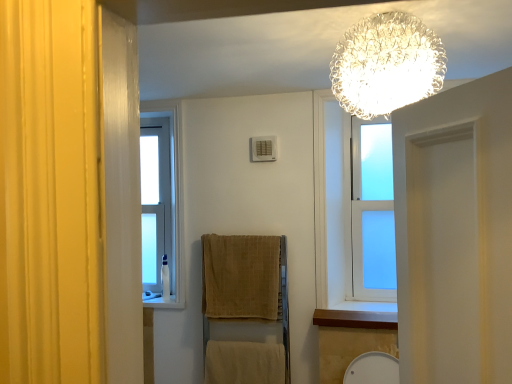
What do you see at coordinates (165, 278) in the screenshot?
I see `white plastic toiletry at left` at bounding box center [165, 278].

Image resolution: width=512 pixels, height=384 pixels. Describe the element at coordinates (241, 276) in the screenshot. I see `beige textured towel at center, which is counted as the 1th bath towel, starting from the top` at that location.

What are the coordinates of `beige cotton towel at lower center, placed as the second bath towel when sorted from top to bottom` in the screenshot? It's located at (244, 363).

This screenshot has width=512, height=384. I want to click on clear glass window at left, so [x=164, y=200].

Describe the element at coordinates (355, 319) in the screenshot. I see `wooden at lower right` at that location.

What is the approximate height of wooden at lower right?

2.29 inches.

Locate an element on the screen. The image size is (512, 384). white plastic toiletry at left is located at coordinates click(165, 278).

Is white plastic toiletry at left thinner than beige cotton towel at lower center, placed as the first bath towel when sorted from bottom to top?

No.

Is white plastic toiletry at left taller than beige cotton towel at lower center, placed as the second bath towel when sorted from top to bottom?

Incorrect, the height of white plastic toiletry at left is not larger of that of beige cotton towel at lower center, placed as the second bath towel when sorted from top to bottom.

Is white plastic toiletry at left positioned far away from beige cotton towel at lower center, placed as the first bath towel when sorted from bottom to top?

That's not correct — white plastic toiletry at left is a little close to beige cotton towel at lower center, placed as the first bath towel when sorted from bottom to top.

Is white plastic toiletry at left inside the boundaries of clear glass window at left, or outside?

white plastic toiletry at left is not enclosed by clear glass window at left.

From a real-world perspective, which is physically below, white plastic toiletry at left or clear glass window at left?

white plastic toiletry at left is physically lower.

Which is in front, point (164, 265) or point (144, 199)?

The point (164, 265) is more forward.

Is clear glass window at left smaller than wooden at lower right?

Actually, clear glass window at left might be larger than wooden at lower right.

The height and width of the screenshot is (384, 512). Identify the location of window above the wooden at lower right (from a real-world perspective). coord(164,200).

From a real-world perspective, is clear glass window at left located beneath wooden at lower right?

No, from a real-world perspective, clear glass window at left is not under wooden at lower right.

Is white plastic toiletry at left aimed at beige textured towel at center, which is counted as the 1th bath towel, starting from the top?

No, white plastic toiletry at left does not turn towards beige textured towel at center, which is counted as the 1th bath towel, starting from the top.

Considering the sizes of white plastic toiletry at left and beige textured towel at center, which is counted as the 1th bath towel, starting from the top, in the image, is white plastic toiletry at left wider or thinner than beige textured towel at center, which is counted as the 1th bath towel, starting from the top,?

white plastic toiletry at left is thinner than beige textured towel at center, which is counted as the 1th bath towel, starting from the top.

Between white plastic toiletry at left and beige textured towel at center, which is counted as the 1th bath towel, starting from the top, which one has larger size?

Bigger between the two is beige textured towel at center, which is counted as the 1th bath towel, starting from the top.

Is beige cotton towel at lower center, placed as the second bath towel when sorted from top to bottom, bigger or smaller than wooden at lower right?

In the image, beige cotton towel at lower center, placed as the second bath towel when sorted from top to bottom, appears to be larger than wooden at lower right.

How different are the orientations of beige cotton towel at lower center, placed as the second bath towel when sorted from top to bottom, and wooden at lower right in degrees?

The angle between the facing direction of beige cotton towel at lower center, placed as the second bath towel when sorted from top to bottom, and the facing direction of wooden at lower right is 0.0361 degrees.

Does beige cotton towel at lower center, placed as the first bath towel when sorted from bottom to top, come in front of wooden at lower right?

No, the depth of beige cotton towel at lower center, placed as the first bath towel when sorted from bottom to top, is greater than that of wooden at lower right.

From the image's perspective, is wooden at lower right positioned above or below crystalline glass chandelier at upper center?

From the image's perspective, wooden at lower right appears below crystalline glass chandelier at upper center.

Is wooden at lower right taller or shorter than crystalline glass chandelier at upper center?

Clearly, wooden at lower right is shorter compared to crystalline glass chandelier at upper center.

What's the angular difference between wooden at lower right and crystalline glass chandelier at upper center's facing directions?

The angular difference between wooden at lower right and crystalline glass chandelier at upper center is 1.17 degrees.

Find the location of a particular element. lamp located on the left of wooden at lower right is located at coordinates (386, 65).

Between beige textured towel at center, which is counted as the 1th bath towel, starting from the top, and clear glass window at left, which one has larger width?

Wider between the two is beige textured towel at center, which is counted as the 1th bath towel, starting from the top.

Looking at this image, from the image's perspective, who appears lower, beige textured towel at center, which is counted as the 1th bath towel, starting from the top, or clear glass window at left?

From the image's view, beige textured towel at center, which is counted as the 1th bath towel, starting from the top, is below.

Is beige textured towel at center, positioned as the 2th bath towel in bottom-to-top order, next to clear glass window at left and touching it?

No, beige textured towel at center, positioned as the 2th bath towel in bottom-to-top order, is not next to clear glass window at left.

Is clear glass window at left inside beige textured towel at center, positioned as the 2th bath towel in bottom-to-top order?

No, beige textured towel at center, positioned as the 2th bath towel in bottom-to-top order, does not contain clear glass window at left.

Find the location of a particular element. the 1st bath towel in front of the white plastic toiletry at left is located at coordinates (244, 363).

The image size is (512, 384). I want to click on window above the white plastic toiletry at left (from a real-world perspective), so click(x=164, y=200).

Estimate the real-world distances between objects in this image. Which object is further from clear glass window at left, beige cotton towel at lower center, placed as the first bath towel when sorted from bottom to top, or wooden at lower right?

wooden at lower right is positioned further to the anchor clear glass window at left.

Considering their positions, is crystalline glass chandelier at upper center positioned further to beige textured towel at center, positioned as the 2th bath towel in bottom-to-top order, than wooden at lower right?

crystalline glass chandelier at upper center is further to beige textured towel at center, positioned as the 2th bath towel in bottom-to-top order.

Based on their spatial positions, is crystalline glass chandelier at upper center or beige textured towel at center, positioned as the 2th bath towel in bottom-to-top order, closer to clear glass window at left?

beige textured towel at center, positioned as the 2th bath towel in bottom-to-top order, is closer to clear glass window at left.

From the image, which object appears to be farther from wooden at lower right, beige textured towel at center, which is counted as the 1th bath towel, starting from the top, or white plastic toiletry at left?

Based on the image, white plastic toiletry at left appears to be further to wooden at lower right.

From the image, which object appears to be farther from clear glass window at left, wooden at lower right or beige textured towel at center, which is counted as the 1th bath towel, starting from the top?

Based on the image, wooden at lower right appears to be further to clear glass window at left.

Considering their positions, is wooden at lower right positioned further to beige textured towel at center, which is counted as the 1th bath towel, starting from the top, than white plastic toiletry at left?

The object further to beige textured towel at center, which is counted as the 1th bath towel, starting from the top, is white plastic toiletry at left.

Which object lies nearer to the anchor point wooden at lower right, crystalline glass chandelier at upper center or beige cotton towel at lower center, placed as the first bath towel when sorted from bottom to top?

Based on the image, beige cotton towel at lower center, placed as the first bath towel when sorted from bottom to top, appears to be nearer to wooden at lower right.

Which object lies further to the anchor point beige cotton towel at lower center, placed as the second bath towel when sorted from top to bottom, crystalline glass chandelier at upper center or clear glass window at left?

The object further to beige cotton towel at lower center, placed as the second bath towel when sorted from top to bottom, is crystalline glass chandelier at upper center.

At what (x,y) coordinates should I click in order to perform the action: click on bath towel between clear glass window at left and beige cotton towel at lower center, placed as the first bath towel when sorted from bottom to top, from top to bottom. Please return your answer as a coordinate pair (x, y). Looking at the image, I should click on (241, 276).

Find the location of `window sill located between crystalline glass chandelier at upper center and beige textured towel at center, positioned as the 2th bath towel in bottom-to-top order, in the depth direction`. window sill located between crystalline glass chandelier at upper center and beige textured towel at center, positioned as the 2th bath towel in bottom-to-top order, in the depth direction is located at coordinates (355, 319).

Find the location of a particular element. The width and height of the screenshot is (512, 384). window sill between crystalline glass chandelier at upper center and beige cotton towel at lower center, placed as the first bath towel when sorted from bottom to top, vertically is located at coordinates (355, 319).

Image resolution: width=512 pixels, height=384 pixels. I want to click on window sill located between crystalline glass chandelier at upper center and clear glass window at left in the depth direction, so click(355, 319).